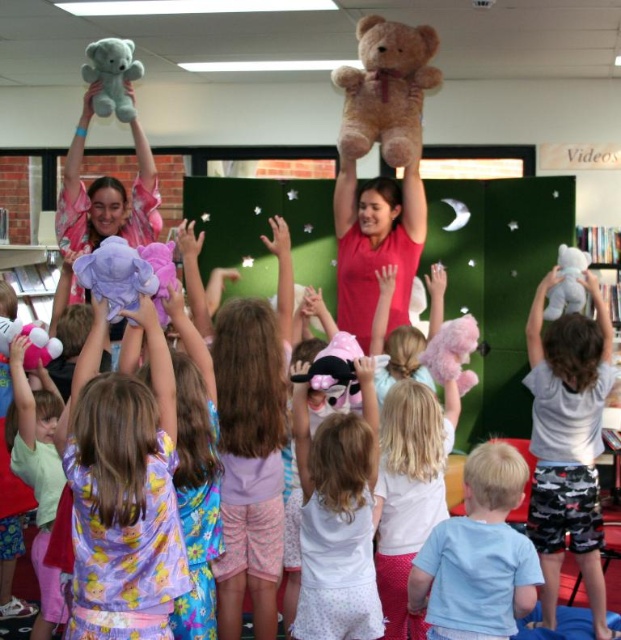
Describe the element at coordinates (479, 552) in the screenshot. I see `light blue cotton shirt at lower right` at that location.

Is light blue cotton shirt at lower right wider than pink plush bear at upper left?

No.

You are a GUI agent. You are given a task and a screenshot of the screen. Output one action in this format:
    pyautogui.click(x=<x>, y=<y>)
    Task: Click on the light blue cotton shirt at lower right
    
    Given the screenshot: What is the action you would take?
    pyautogui.click(x=479, y=552)

Where is `light blue cotton shirt at lower right`? The height and width of the screenshot is (640, 621). light blue cotton shirt at lower right is located at coordinates (479, 552).

Can you confirm if white matte shirt at center is thinner than soft brown teddy bear at upper center?

Indeed, white matte shirt at center has a lesser width compared to soft brown teddy bear at upper center.

Can you confirm if white matte shirt at center is wider than soft brown teddy bear at upper center?

Incorrect, white matte shirt at center's width does not surpass soft brown teddy bear at upper center's.

Between point (396, 556) and point (399, 97), which one is positioned behind?

Positioned behind is point (399, 97).

The width and height of the screenshot is (621, 640). In order to click on white matte shirt at center in this screenshot , I will do `click(409, 490)`.

Between point (537, 376) and point (102, 96), which one is positioned in front?

Point (537, 376) is in front.

Image resolution: width=621 pixels, height=640 pixels. Describe the element at coordinates (568, 444) in the screenshot. I see `white cotton shirt at upper center` at that location.

Which is in front, point (535, 406) or point (124, 74)?

Point (535, 406) is in front.

This screenshot has height=640, width=621. In order to click on white cotton shirt at upper center in this screenshot , I will do `click(568, 444)`.